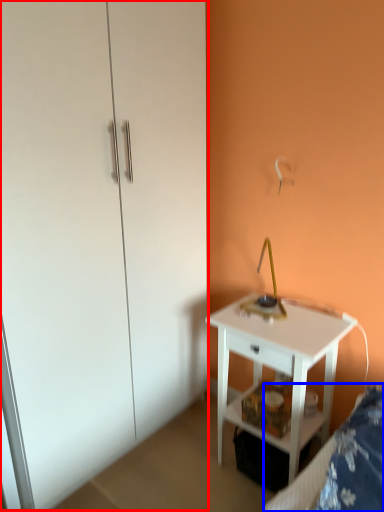
Question: Among these objects, which one is farthest to the camera, dresser (highlighted by a red box) or bed frame (highlighted by a blue box)?

Choices:
 (A) dresser
 (B) bed frame

Answer: (A)